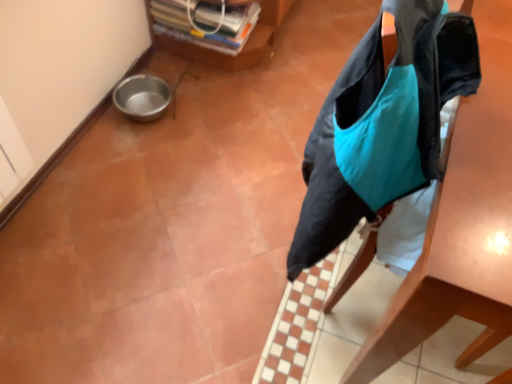
Question: Is plastic transparent container at upper center, the first furniture from the left, situated inside teal fabric bag at right, which is counted as the 2th furniture, starting from the left, or outside?

Choices:
 (A) inside
 (B) outside

Answer: (B)

Question: Based on their positions, is plastic transparent container at upper center, placed as the second furniture when sorted from right to left, located to the left or right of teal fabric bag at right, which is counted as the 2th furniture, starting from the left?

Choices:
 (A) right
 (B) left

Answer: (B)

Question: Looking at the image, does plastic transparent container at upper center, the first furniture from the left, seem bigger or smaller compared to teal fabric bag at right, which is the first furniture from right to left?

Choices:
 (A) big
 (B) small

Answer: (B)

Question: Visually, is teal fabric bag at right, which is the first furniture from right to left, positioned to the left or to the right of plastic transparent container at upper center, placed as the second furniture when sorted from right to left?

Choices:
 (A) left
 (B) right

Answer: (B)

Question: Does point (439, 200) appear closer or farther from the camera than point (269, 39)?

Choices:
 (A) closer
 (B) farther

Answer: (A)

Question: Relative to plastic transparent container at upper center, placed as the second furniture when sorted from right to left, is teal fabric bag at right, which is the first furniture from right to left, in front or behind?

Choices:
 (A) front
 (B) behind

Answer: (A)

Question: From their relative heights in the image, would you say teal fabric bag at right, which is the first furniture from right to left, is taller or shorter than plastic transparent container at upper center, the first furniture from the left?

Choices:
 (A) short
 (B) tall

Answer: (B)